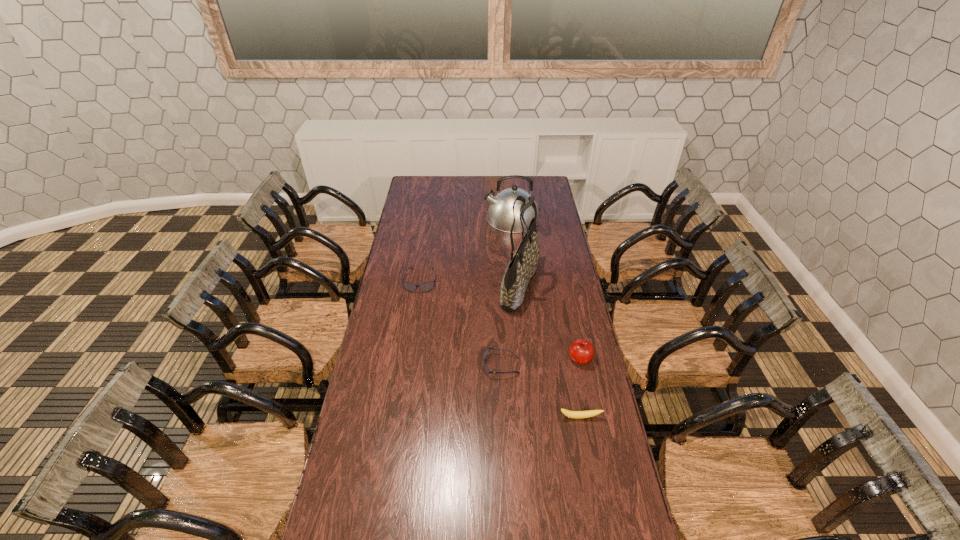
At what (x,y) coordinates should I click in order to perform the action: click on vacant point that satisfies the following two spatial constraints: 1. from the spout of the farthest object; 2. on the lenses of the left sunglasses. Please return your answer as a coordinate pair (x, y). Looking at the image, I should click on (518, 281).

Find the location of a particular element. The height and width of the screenshot is (540, 960). free spot that satisfies the following two spatial constraints: 1. on the lenses of the apple; 2. on the left side of the farther sunglasses is located at coordinates (408, 359).

The image size is (960, 540). I want to click on vacant area in the image that satisfies the following two spatial constraints: 1. from the spout of the farthest object; 2. on the left side of the tote bag, so click(x=518, y=286).

The height and width of the screenshot is (540, 960). In order to click on free space that satisfies the following two spatial constraints: 1. on the front side of the tote bag; 2. on the right side of the apple in this screenshot , I will do `click(527, 359)`.

The image size is (960, 540). I want to click on free spot that satisfies the following two spatial constraints: 1. on the back side of the tote bag; 2. from the spout of the fifth shortest object, so click(513, 218).

This screenshot has height=540, width=960. I want to click on vacant space that satisfies the following two spatial constraints: 1. on the front side of the apple; 2. on the left side of the tallest object, so click(x=527, y=359).

In order to click on vacant space that satisfies the following two spatial constraints: 1. on the lenses of the apple; 2. on the left side of the farther sunglasses in this screenshot , I will do `click(408, 359)`.

At what (x,y) coordinates should I click in order to perform the action: click on free region that satisfies the following two spatial constraints: 1. on the lenses of the third tallest object; 2. on the right side of the taller sunglasses. Please return your answer as a coordinate pair (x, y). The height and width of the screenshot is (540, 960). Looking at the image, I should click on (408, 359).

You are a GUI agent. You are given a task and a screenshot of the screen. Output one action in this format:
    pyautogui.click(x=<x>, y=<y>)
    Task: Click on the vacant area that satisfies the following two spatial constraints: 1. on the front side of the tallest object; 2. on the right side of the third tallest object
    
    Given the screenshot: What is the action you would take?
    pyautogui.click(x=527, y=359)